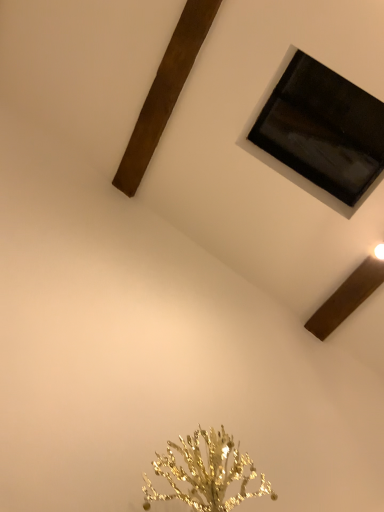
Image resolution: width=384 pixels, height=512 pixels. What do you see at coordinates (323, 129) in the screenshot?
I see `black matte picture frame at upper right` at bounding box center [323, 129].

What is the approximate width of black matte picture frame at upper right?

It is 13.29 inches.

Measure the distance between black matte picture frame at upper right and camera.

black matte picture frame at upper right is 5.70 feet away from camera.

Where is `black matte picture frame at upper right`? This screenshot has width=384, height=512. black matte picture frame at upper right is located at coordinates (323, 129).

Locate an element on the screen. black matte picture frame at upper right is located at coordinates click(323, 129).